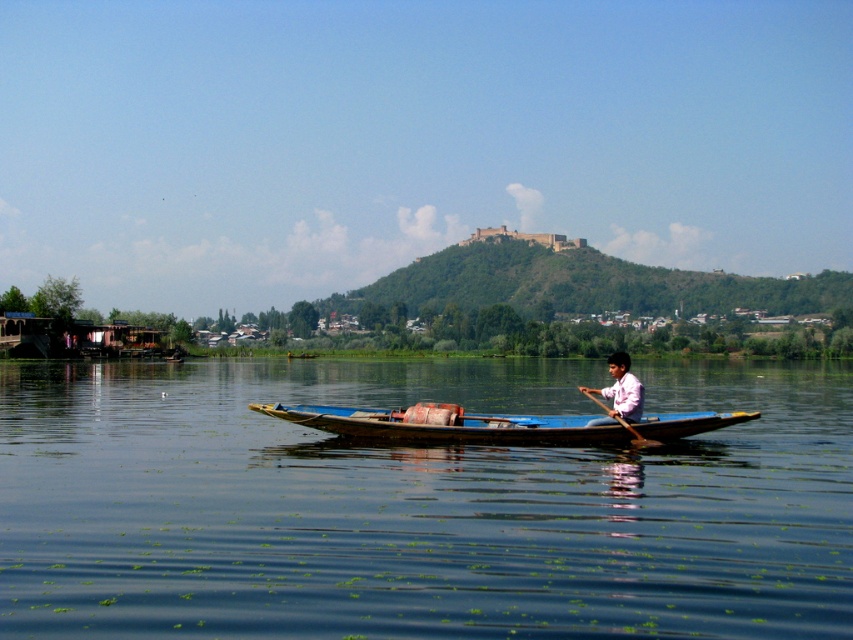
Question: Is blue wooden boat at center wider than wooden at center?

Choices:
 (A) yes
 (B) no

Answer: (A)

Question: Is the position of blue wooden canoe at center more distant than that of pink cotton shirt at center?

Choices:
 (A) yes
 (B) no

Answer: (A)

Question: Which point is closer to the camera?

Choices:
 (A) (363, 506)
 (B) (642, 436)
 (C) (636, 397)
 (D) (671, 429)

Answer: (A)

Question: Is pink cotton shirt at center positioned at the back of wooden at center?

Choices:
 (A) no
 (B) yes

Answer: (A)

Question: Which point is closer to the camera?

Choices:
 (A) blue wooden boat at center
 (B) pink cotton shirt at center
 (C) wooden at center
 (D) blue wooden canoe at center

Answer: (A)

Question: Which of the following is the farthest from the observer?

Choices:
 (A) blue wooden boat at center
 (B) wooden at center
 (C) blue wooden canoe at center

Answer: (B)